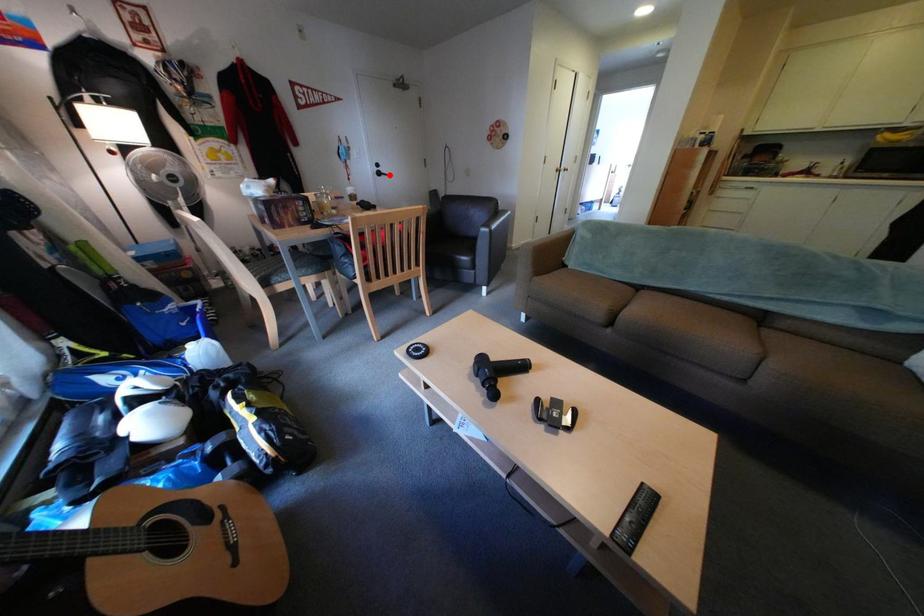
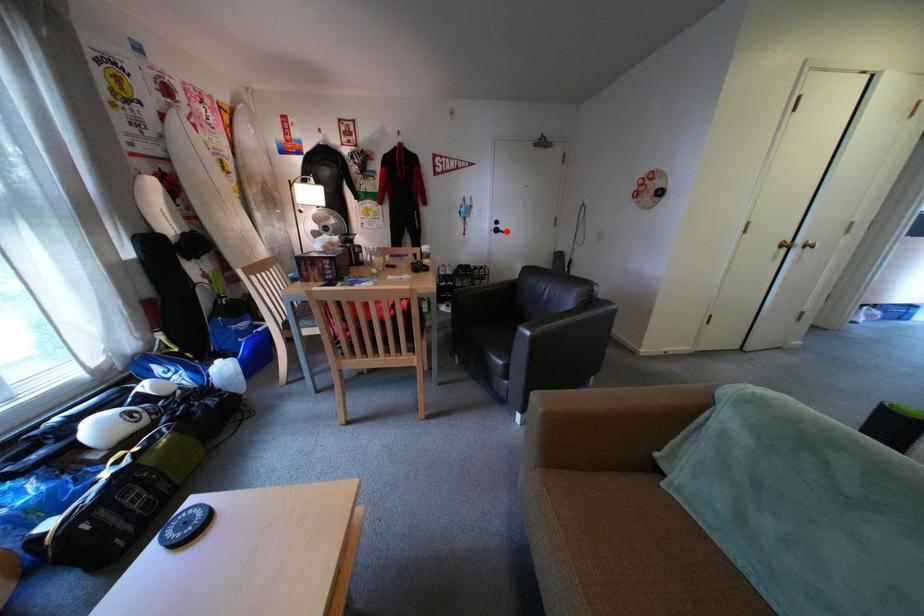
I am providing you with two images of the same scene from different viewpoints. A red point is marked on the first image and another point is marked on the second image. Is the red point in image1 aligned with the point shown in image2?

Yes